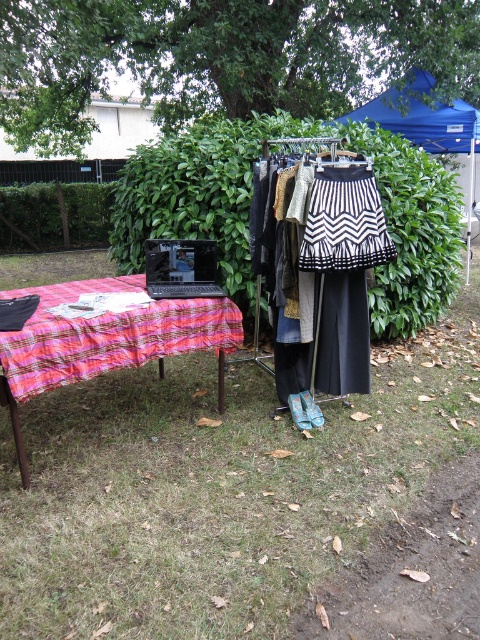
Is green grass at lower center to the left of plaid fabric picnic table at left from the viewer's perspective?

In fact, green grass at lower center is to the right of plaid fabric picnic table at left.

Which is below, green grass at lower center or plaid fabric picnic table at left?

green grass at lower center

What do you see at coordinates (217, 490) in the screenshot? The height and width of the screenshot is (640, 480). I see `green grass at lower center` at bounding box center [217, 490].

Where is `green grass at lower center`? This screenshot has width=480, height=640. green grass at lower center is located at coordinates (217, 490).

Who is shorter, plaid fabric picnic table at left or blue fabric canopy at upper right?

Standing shorter between the two is plaid fabric picnic table at left.

Which of these two, plaid fabric picnic table at left or blue fabric canopy at upper right, stands taller?

With more height is blue fabric canopy at upper right.

Which is in front, point (104, 344) or point (418, 97)?

Point (104, 344) is more forward.

You are a GUI agent. You are given a task and a screenshot of the screen. Output one action in this format:
    pyautogui.click(x=<x>, y=<y>)
    Task: Click on the plaid fabric picnic table at left
    
    Given the screenshot: What is the action you would take?
    pyautogui.click(x=106, y=340)

Can you confirm if green grass at lower center is smaller than blue fabric canopy at upper right?

No.

Which is more to the left, green grass at lower center or blue fabric canopy at upper right?

From the viewer's perspective, green grass at lower center appears more on the left side.

Is point (122, 532) more distant than point (412, 100)?

No, (122, 532) is in front of (412, 100).

Find the location of a particular element. This screenshot has height=640, width=480. green grass at lower center is located at coordinates (217, 490).